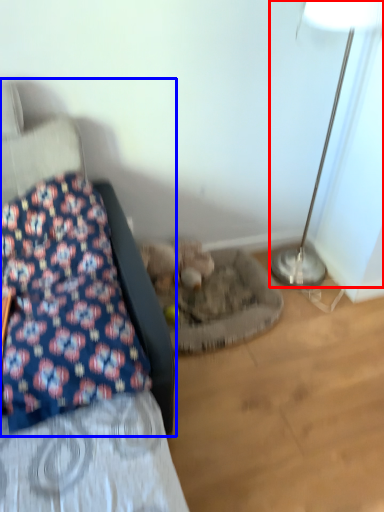
Question: Which point is closer to the camera, lamp (highlighted by a red box) or furniture (highlighted by a blue box)?

Choices:
 (A) lamp
 (B) furniture

Answer: (B)